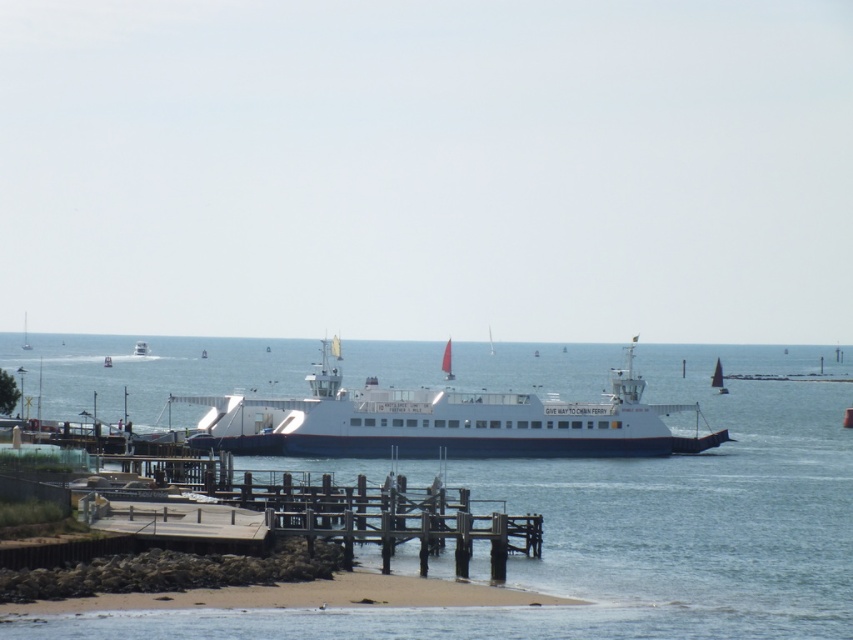
Who is shorter, white matte ferry at center or wooden pier at lower left?

With less height is wooden pier at lower left.

Does white matte ferry at center have a greater width compared to wooden pier at lower left?

Indeed, white matte ferry at center has a greater width compared to wooden pier at lower left.

Where is `white matte ferry at center`? Image resolution: width=853 pixels, height=640 pixels. white matte ferry at center is located at coordinates (440, 420).

Can you confirm if blue water at center is bigger than wooden pier at lower left?

Yes.

In the scene shown: Who is shorter, blue water at center or wooden pier at lower left?

Standing shorter between the two is wooden pier at lower left.

Who is more distant from viewer, [698,589] or [526,513]?

The point [526,513] is more distant.

The height and width of the screenshot is (640, 853). I want to click on blue water at center, so click(637, 529).

In the scene shown: Does blue water at center have a lesser width compared to white matte ferry at center?

No.

Who is higher up, blue water at center or white matte ferry at center?

white matte ferry at center is higher up.

Which is behind, point (746, 348) or point (375, 438)?

Positioned behind is point (746, 348).

Identify the location of blue water at center. (637, 529).